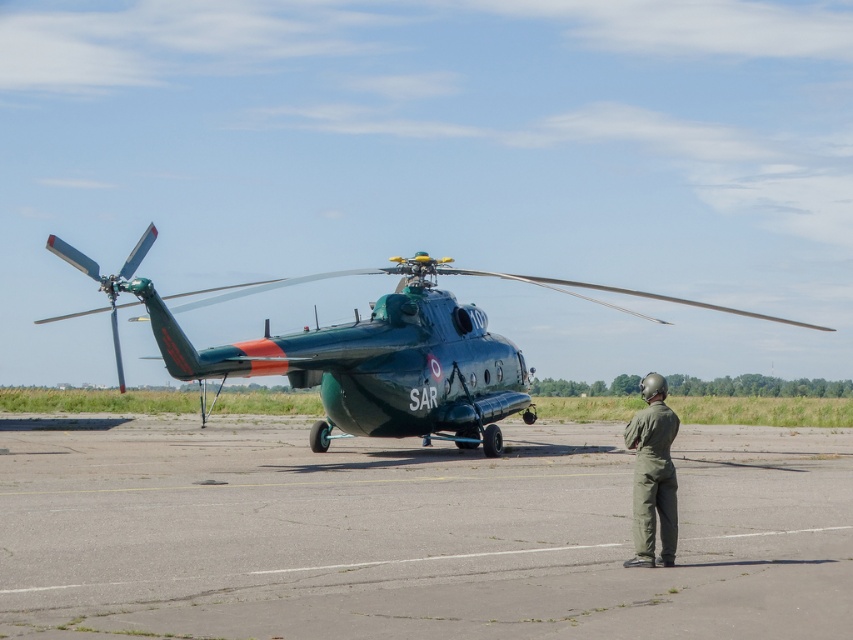
Between gray asphalt tarmac at center and green fabric jumpsuit at lower right, which one appears on the right side from the viewer's perspective?

green fabric jumpsuit at lower right is more to the right.

Who is higher up, gray asphalt tarmac at center or green fabric jumpsuit at lower right?

green fabric jumpsuit at lower right

Is point (381, 500) positioned after point (666, 518)?

That is True.

Locate an element on the screen. This screenshot has width=853, height=640. gray asphalt tarmac at center is located at coordinates (412, 532).

Is green metallic helicopter at center thinner than green fabric jumpsuit at lower right?

In fact, green metallic helicopter at center might be wider than green fabric jumpsuit at lower right.

Which is behind, point (460, 440) or point (643, 525)?

The point (460, 440) is more distant.

The height and width of the screenshot is (640, 853). Describe the element at coordinates (363, 349) in the screenshot. I see `green metallic helicopter at center` at that location.

Where is `green metallic helicopter at center`? green metallic helicopter at center is located at coordinates (363, 349).

Where is `gray asphalt tarmac at center`? gray asphalt tarmac at center is located at coordinates (412, 532).

Can you confirm if gray asphalt tarmac at center is wider than green metallic helicopter at center?

No, gray asphalt tarmac at center is not wider than green metallic helicopter at center.

Describe the element at coordinates (412, 532) in the screenshot. The height and width of the screenshot is (640, 853). I see `gray asphalt tarmac at center` at that location.

Find the location of a particular element. gray asphalt tarmac at center is located at coordinates (412, 532).